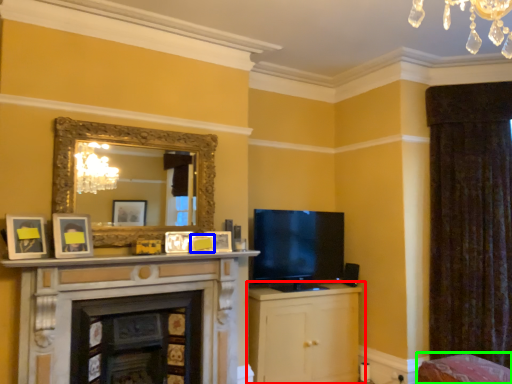
Question: Which object is positioned farthest from cabinetry (highlighted by a red box)? Select from picture frame (highlighted by a blue box) and swivel chair (highlighted by a green box).

Choices:
 (A) picture frame
 (B) swivel chair

Answer: (A)